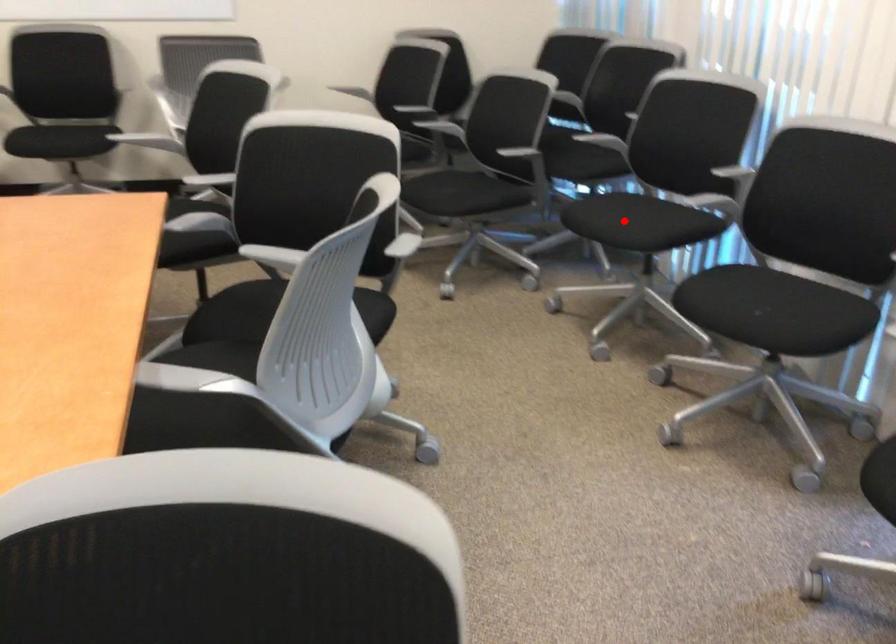
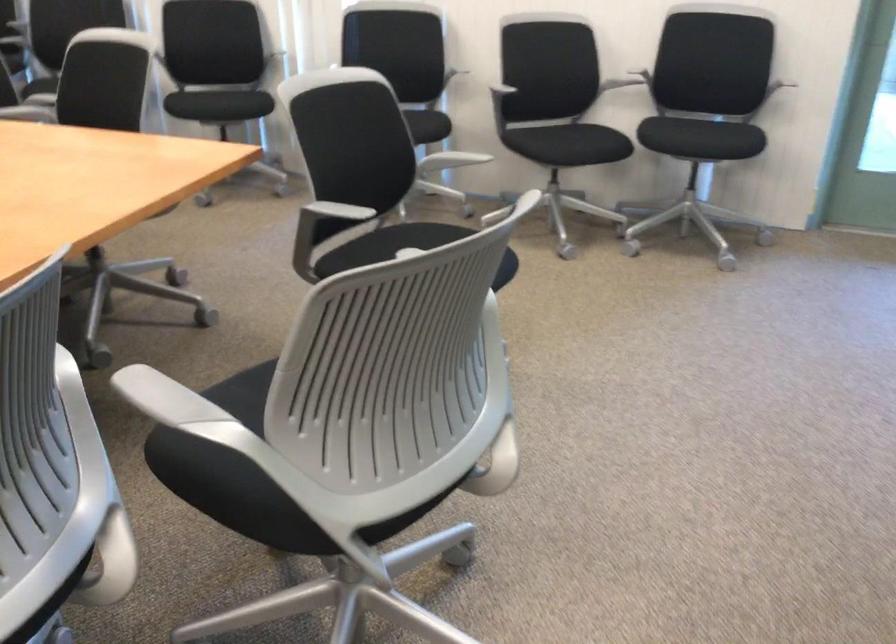
Question: I am providing you with two images of the same scene from different viewpoints. A red point is marked on the first image. Is the red point's position out of view in image 2?

Choices:
 (A) Yes
 (B) No

Answer: (A)